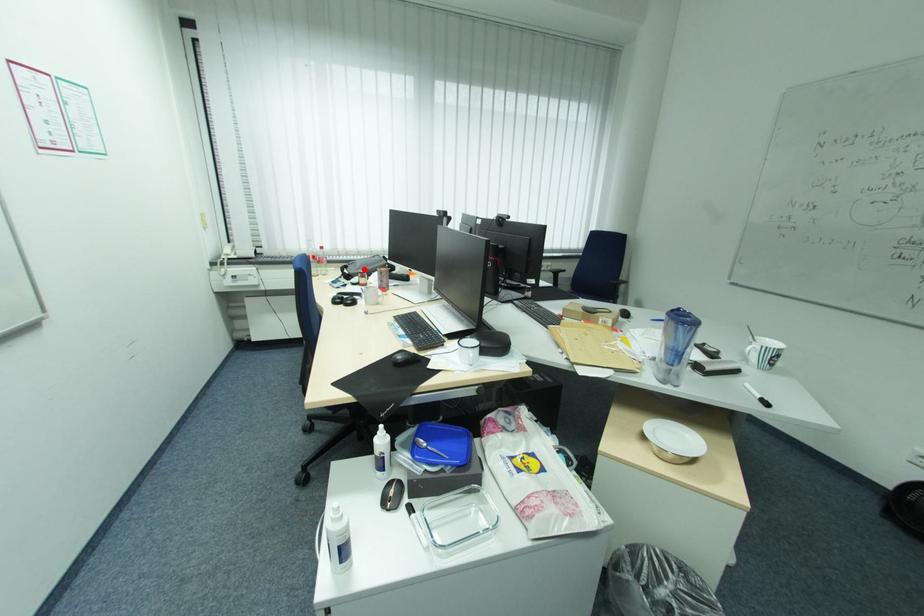
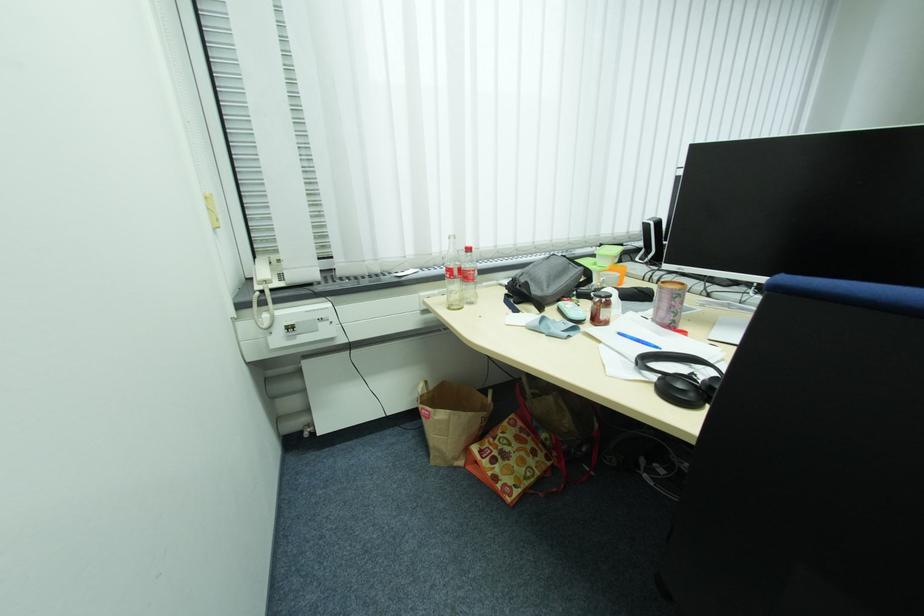
In the second image, find the point that corresponds to the highlighted location in the first image.

(554, 286)